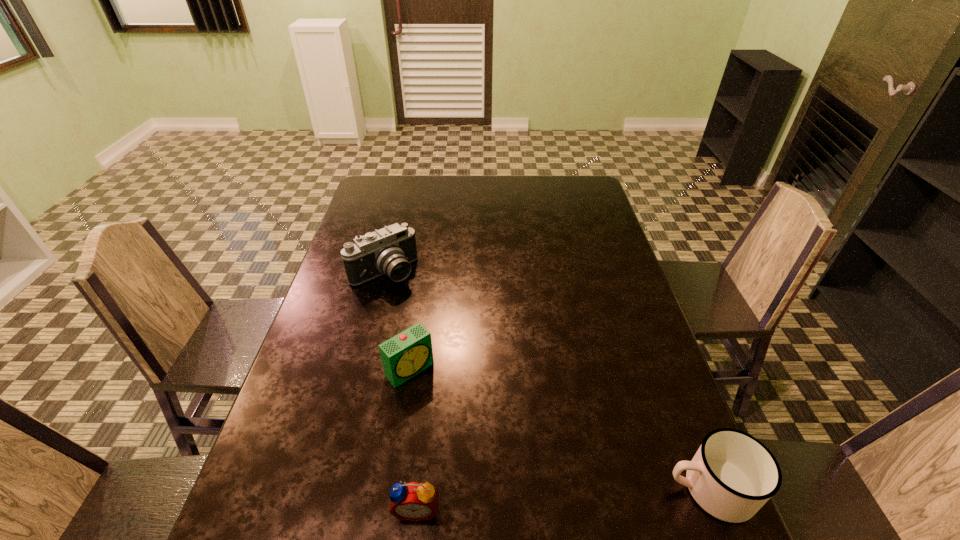
This screenshot has width=960, height=540. I want to click on vacant space situated 0.270m on the front-facing side of the camera, so click(x=450, y=343).

Locate an element on the screen. The width and height of the screenshot is (960, 540). free space located on the front-facing side of the third nearest object is located at coordinates (435, 397).

Identify the location of free point located on the front-facing side of the third nearest object. This screenshot has width=960, height=540. (482, 450).

The width and height of the screenshot is (960, 540). In order to click on free space located on the front-facing side of the third nearest object in this screenshot , I will do `click(468, 434)`.

You are a GUI agent. You are given a task and a screenshot of the screen. Output one action in this format:
    pyautogui.click(x=<x>, y=<y>)
    Task: Click on the alarm clock at the near edge
    
    Given the screenshot: What is the action you would take?
    pyautogui.click(x=413, y=501)

Find the location of a particular element. mug positioned at the near edge is located at coordinates (732, 475).

The image size is (960, 540). What are the coordinates of `object at the left edge` in the screenshot? It's located at (390, 250).

Identify the location of object at the right edge. Image resolution: width=960 pixels, height=540 pixels. (732, 475).

Find the location of a particular element. object at the near right corner is located at coordinates (732, 475).

Identify the location of free space at the far edge. (468, 194).